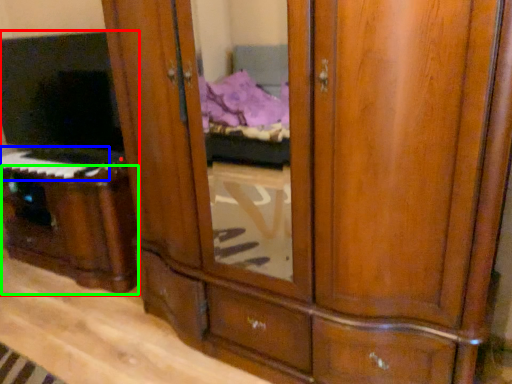
Question: Which object is the farthest from entertainment center (highlighted by a red box)? Choose among these: musical keyboard (highlighted by a blue box) or vanity (highlighted by a green box).

Choices:
 (A) musical keyboard
 (B) vanity

Answer: (A)